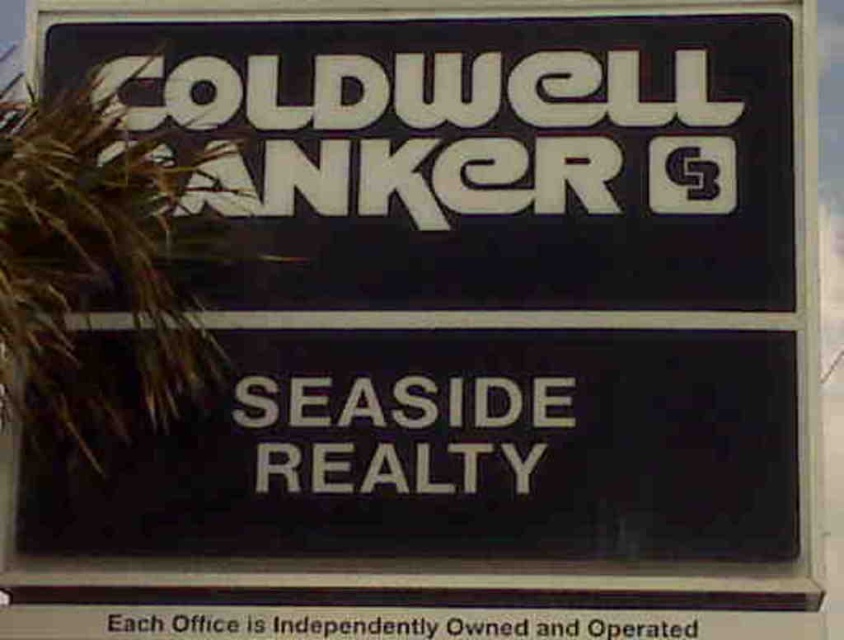
Who is taller, white matte sign at center or black plastic text at lower center?

With more height is black plastic text at lower center.

Does white matte sign at center appear over black plastic text at lower center?

Correct, white matte sign at center is located above black plastic text at lower center.

Image resolution: width=844 pixels, height=640 pixels. Describe the element at coordinates (404, 403) in the screenshot. I see `white matte sign at center` at that location.

What are the coordinates of `white matte sign at center` in the screenshot? It's located at (404, 403).

What do you see at coordinates (452, 451) in the screenshot?
I see `black matte sign at center` at bounding box center [452, 451].

Is black matte sign at center positioned at the back of black plastic text at lower center?

Yes.

Locate an element on the screen. The image size is (844, 640). black matte sign at center is located at coordinates (452, 451).

The width and height of the screenshot is (844, 640). What are the coordinates of `black matte sign at center` in the screenshot? It's located at (452, 451).

Between black matte sign at upper center and black plastic text at lower center, which one is positioned higher?

black matte sign at upper center is above.

Can you confirm if black matte sign at upper center is positioned to the left of black plastic text at lower center?

Indeed, black matte sign at upper center is positioned on the left side of black plastic text at lower center.

Is point (675, 33) in front of point (630, 636)?

No, it is not.

The image size is (844, 640). Identify the location of black matte sign at upper center. (485, 154).